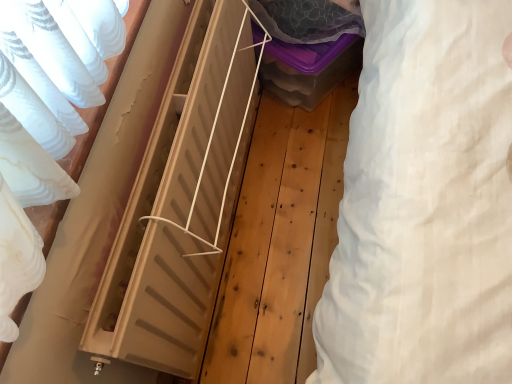
Question: Is translucent plastic storage box at center turned away from white cotton sheet at right?

Choices:
 (A) no
 (B) yes

Answer: (A)

Question: Is translucent plastic storage box at center surrounding white cotton sheet at right?

Choices:
 (A) no
 (B) yes

Answer: (A)

Question: Is there a large distance between translucent plastic storage box at center and white cotton sheet at right?

Choices:
 (A) no
 (B) yes

Answer: (A)

Question: Does translucent plastic storage box at center turn towards white cotton sheet at right?

Choices:
 (A) yes
 (B) no

Answer: (B)

Question: Considering the relative positions of translucent plastic storage box at center and white cotton sheet at right in the image provided, is translucent plastic storage box at center to the right of white cotton sheet at right from the viewer's perspective?

Choices:
 (A) yes
 (B) no

Answer: (B)

Question: Considering the positions of point (376, 306) and point (324, 56), is point (376, 306) closer or farther from the camera than point (324, 56)?

Choices:
 (A) farther
 (B) closer

Answer: (B)

Question: From the image's perspective, is white cotton sheet at right located above or below translucent plastic storage box at center?

Choices:
 (A) above
 (B) below

Answer: (B)

Question: In terms of size, does white cotton sheet at right appear bigger or smaller than translucent plastic storage box at center?

Choices:
 (A) small
 (B) big

Answer: (A)

Question: Considering the positions of white cotton sheet at right and translucent plastic storage box at center in the image, is white cotton sheet at right taller or shorter than translucent plastic storage box at center?

Choices:
 (A) tall
 (B) short

Answer: (A)

Question: From the image's perspective, is translucent plastic storage box at center above or below natural wood radiator at center?

Choices:
 (A) above
 (B) below

Answer: (A)

Question: From their relative heights in the image, would you say translucent plastic storage box at center is taller or shorter than natural wood radiator at center?

Choices:
 (A) tall
 (B) short

Answer: (B)

Question: Looking at the image, does translucent plastic storage box at center seem bigger or smaller compared to natural wood radiator at center?

Choices:
 (A) small
 (B) big

Answer: (B)

Question: Visually, is translucent plastic storage box at center positioned to the left or to the right of natural wood radiator at center?

Choices:
 (A) right
 (B) left

Answer: (A)

Question: Considering their positions, is natural wood radiator at center located in front of or behind translucent plastic storage box at center?

Choices:
 (A) front
 (B) behind

Answer: (A)

Question: From the image's perspective, is natural wood radiator at center above or below translucent plastic storage box at center?

Choices:
 (A) below
 (B) above

Answer: (A)